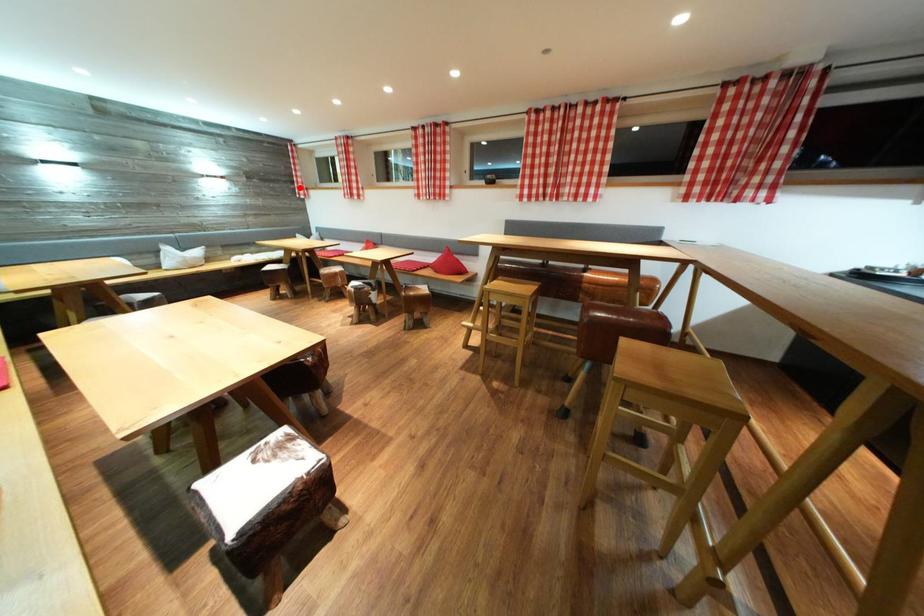
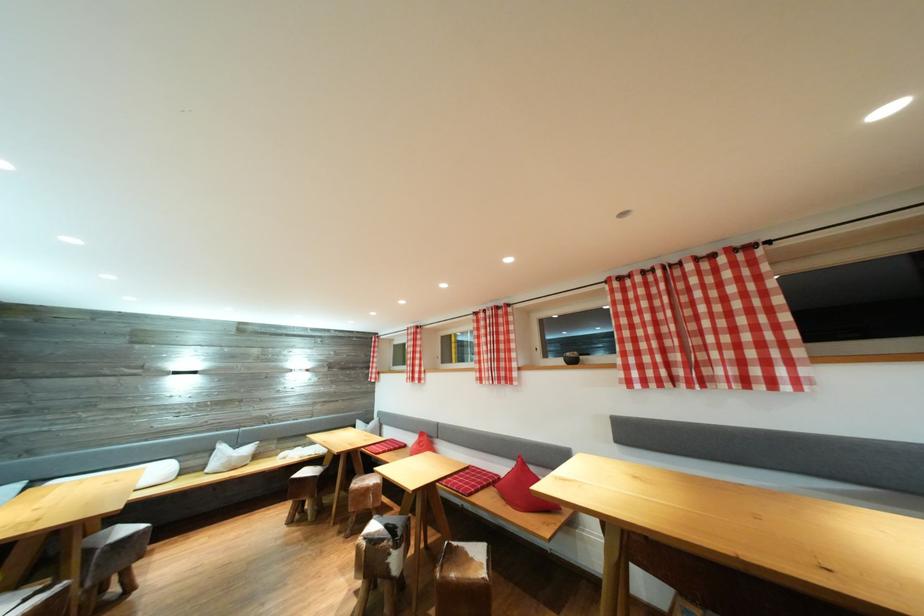
Question: I am providing you with two images of the same scene from different viewpoints. Image1 has a red point marked. In image2, the corresponding 3D location appears at what relative position? Reply with the corresponding letter.

Choices:
 (A) Closer
 (B) Farther

Answer: (B)